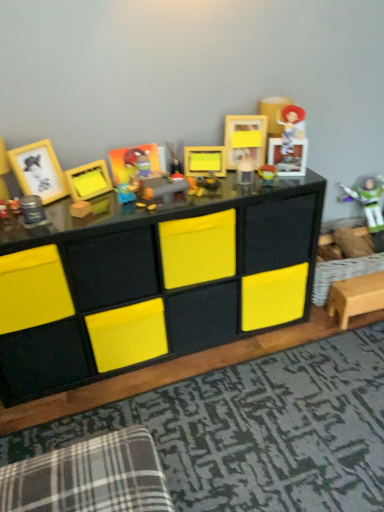
In order to click on vacant area to the left of matte plastic buzz lightyear at center, which is counted as the 3th toy, starting from the back in this screenshot , I will do `click(234, 185)`.